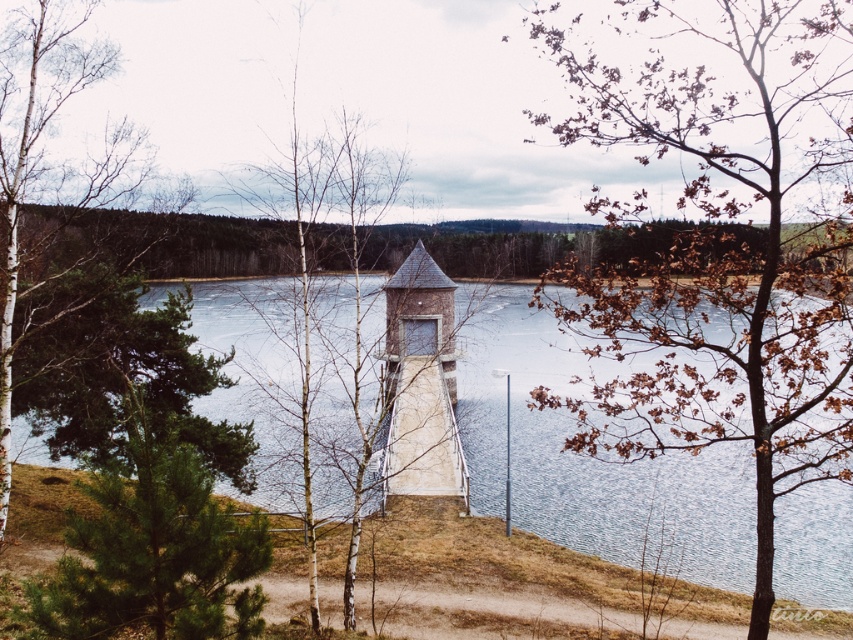
Is point (825, 349) closer to camera compared to point (601, 556)?

Yes, it is in front of point (601, 556).

Which is below, brown leafy tree at right or smooth concrete water at center?

smooth concrete water at center

What do you see at coordinates (723, 257) in the screenshot? The image size is (853, 640). I see `brown leafy tree at right` at bounding box center [723, 257].

Identify the location of brown leafy tree at right. (723, 257).

Does smooth concrete water at center have a greater width compared to green needle-like foliage at center-left?

Correct, the width of smooth concrete water at center exceeds that of green needle-like foliage at center-left.

Does smooth concrete water at center appear under green needle-like foliage at center-left?

Incorrect, smooth concrete water at center is not positioned below green needle-like foliage at center-left.

The height and width of the screenshot is (640, 853). What are the coordinates of `smooth concrete water at center` in the screenshot? It's located at (590, 460).

The height and width of the screenshot is (640, 853). In order to click on smooth concrete water at center in this screenshot , I will do `click(590, 460)`.

Between brown leafy tree at right and green needle-like foliage at center-left, which one has less height?

green needle-like foliage at center-left

At what (x,y) coordinates should I click in order to perform the action: click on brown leafy tree at right. Please return your answer as a coordinate pair (x, y). This screenshot has width=853, height=640. Looking at the image, I should click on (723, 257).

At what (x,y) coordinates should I click in order to perform the action: click on brown leafy tree at right. Please return your answer as a coordinate pair (x, y). Looking at the image, I should click on (723, 257).